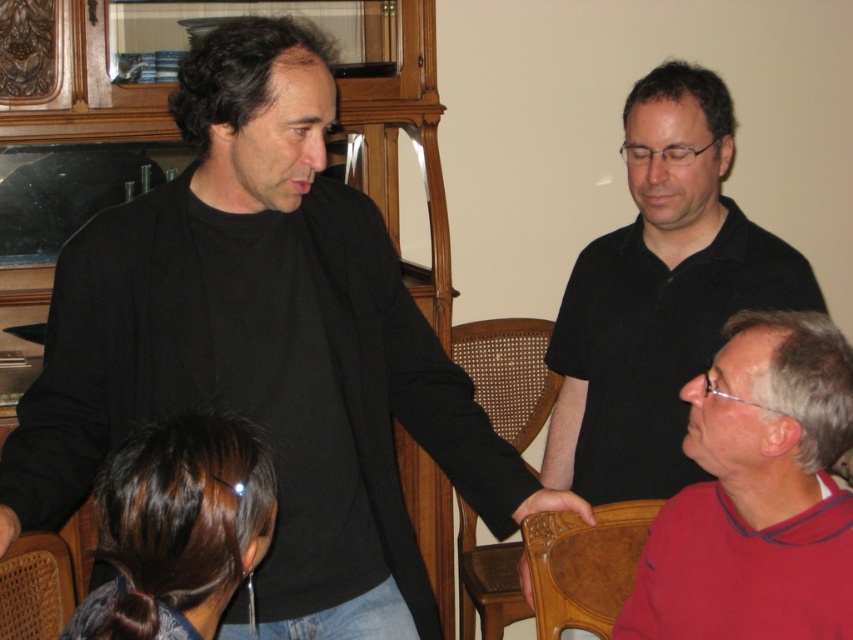
You are planning to seat a group of people in this room and need to choose between the beech wood chair at lower center and the brown woven chair at lower left. Based on their sizes, which chair would allow more space for someone sitting next to it?

The beech wood chair at lower center has a larger width than the brown woven chair at lower left, so it would allow more space for someone sitting next to it.

Based on the scene description, where is the black matte shirt at center located in terms of coordinates?

The black matte shirt at center is located at coordinates point (265, 348).